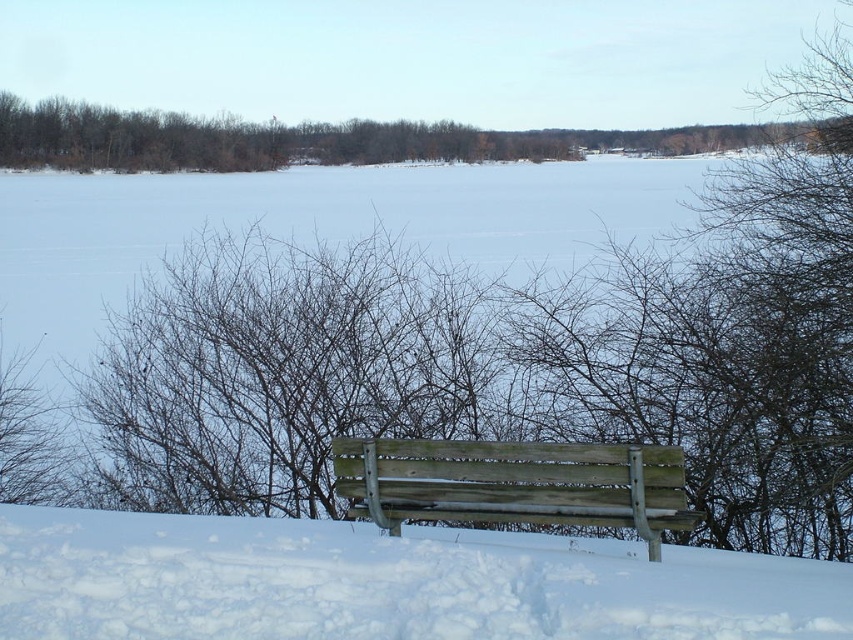
Find the location of a particular element. The height and width of the screenshot is (640, 853). white fluffy snow at lower center is located at coordinates (387, 582).

Who is taller, white fluffy snow at lower center or weathered wood bench at center?

With more height is weathered wood bench at center.

Is point (68, 520) positioned in front of point (549, 497)?

No, (68, 520) is further to viewer.

Find the location of a particular element. The image size is (853, 640). white fluffy snow at lower center is located at coordinates (387, 582).

Which of these two, brown/dry wood trees at upper center or weathered wood bench at center, stands shorter?

Standing shorter between the two is weathered wood bench at center.

Who is positioned more to the right, brown/dry wood trees at upper center or weathered wood bench at center?

weathered wood bench at center is more to the right.

I want to click on brown/dry wood trees at upper center, so tap(328, 140).

Which of these two, white fluffy snow at lower center or brown/dry wood trees at upper center, stands taller?

brown/dry wood trees at upper center

Is white fluffy snow at lower center thinner than brown/dry wood trees at upper center?

Indeed, white fluffy snow at lower center has a lesser width compared to brown/dry wood trees at upper center.

Is point (90, 605) positioned behind point (442, 145)?

No.

What are the coordinates of `white fluffy snow at lower center` in the screenshot? It's located at (387, 582).